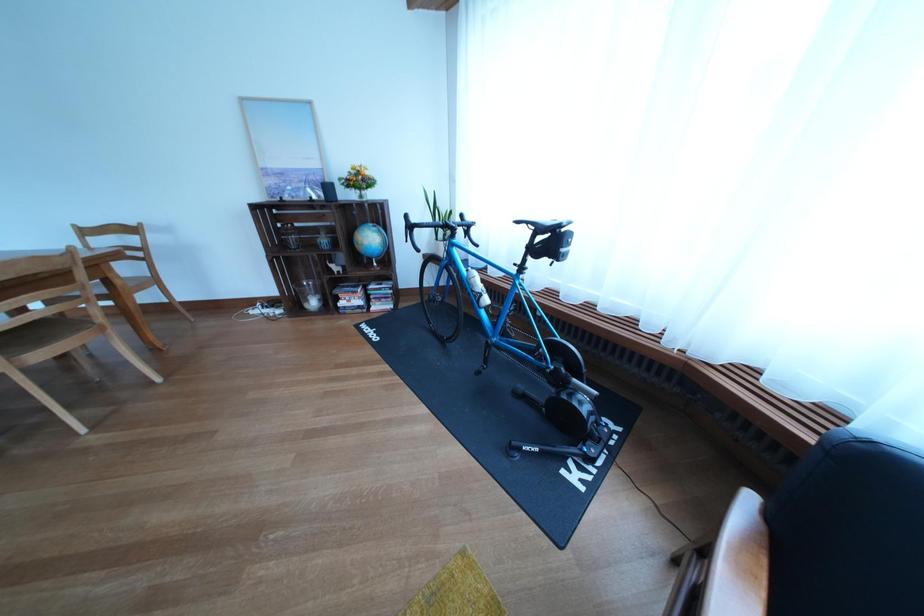
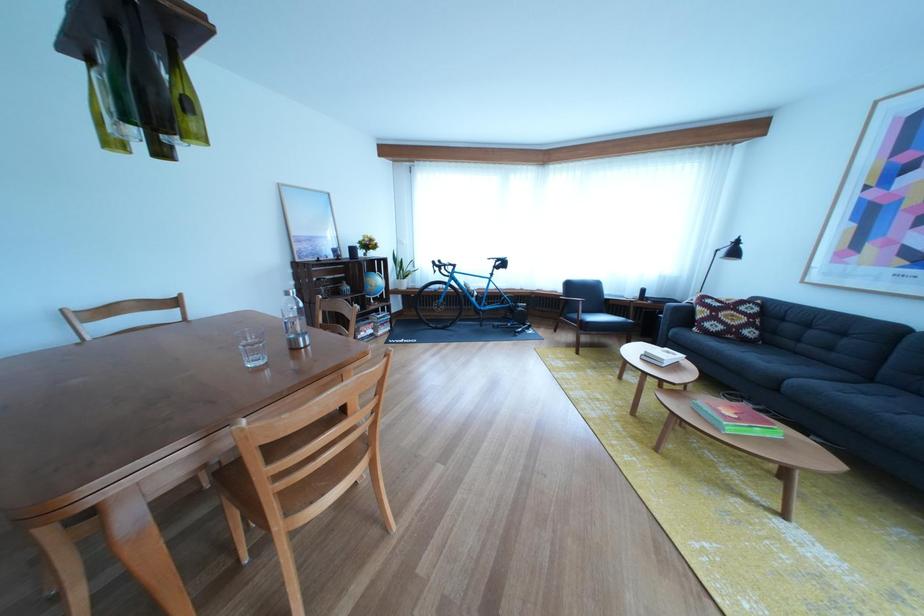
In the second image, find the point that corresponds to (x=348, y=252) in the first image.

(367, 297)